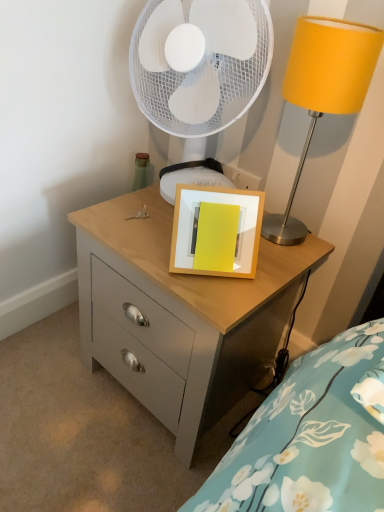
I want to click on white mesh mechanical fan at upper center, so click(x=206, y=72).

Describe the element at coordinates (202, 227) in the screenshot. I see `wooden picture frame at center` at that location.

Image resolution: width=384 pixels, height=512 pixels. I want to click on wooden picture frame at center, so click(202, 227).

Locate an element on the screen. This screenshot has width=384, height=512. white mesh mechanical fan at upper center is located at coordinates (206, 72).

From a real-world perspective, is wooden picture frame at center under white mesh mechanical fan at upper center?

Yes, from a real-world perspective, wooden picture frame at center is beneath white mesh mechanical fan at upper center.

This screenshot has height=512, width=384. I want to click on picture frame below the white mesh mechanical fan at upper center (from a real-world perspective), so click(202, 227).

Looking at this image, considering the sizes of objects wooden picture frame at center and white mesh mechanical fan at upper center in the image provided, who is shorter, wooden picture frame at center or white mesh mechanical fan at upper center?

wooden picture frame at center.

How many degrees apart are the facing directions of wooden picture frame at center and white mesh mechanical fan at upper center?

The angle between the facing direction of wooden picture frame at center and the facing direction of white mesh mechanical fan at upper center is 41.6 degrees.

Which is farther, (187,246) or (177,378)?

The point (177,378) is more distant.

Between wooden picture frame at center and matte wood chest of drawers at center, which one appears on the right side from the viewer's perspective?

Positioned to the right is wooden picture frame at center.

Can you confirm if wooden picture frame at center is thinner than matte wood chest of drawers at center?

Yes, wooden picture frame at center is thinner than matte wood chest of drawers at center.

Looking at the image, does wooden picture frame at center seem bigger or smaller compared to matte wood chest of drawers at center?

Clearly, wooden picture frame at center is smaller in size than matte wood chest of drawers at center.

Which is closer, (x=380, y=32) or (x=216, y=200)?

Clearly, point (x=380, y=32) is closer to the camera than point (x=216, y=200).

Looking at the image, does metallic yellow lampshade at upper right seem bigger or smaller compared to wooden picture frame at center?

Clearly, metallic yellow lampshade at upper right is larger in size than wooden picture frame at center.

How far apart are metallic yellow lampshade at upper right and wooden picture frame at center?

The distance of metallic yellow lampshade at upper right from wooden picture frame at center is 8.93 inches.

How different are the orientations of metallic yellow lampshade at upper right and wooden picture frame at center in degrees?

43.2 degrees separate the facing orientations of metallic yellow lampshade at upper right and wooden picture frame at center.

Is point (162, 195) farther from viewer compared to point (247, 317)?

Yes, it is behind point (247, 317).

Which is in front, white mesh mechanical fan at upper center or matte wood chest of drawers at center?

matte wood chest of drawers at center is in front.

Considering the sizes of objects white mesh mechanical fan at upper center and matte wood chest of drawers at center in the image provided, who is taller, white mesh mechanical fan at upper center or matte wood chest of drawers at center?

Standing taller between the two is matte wood chest of drawers at center.

Is there a large distance between white mesh mechanical fan at upper center and matte wood chest of drawers at center?

That's not correct — white mesh mechanical fan at upper center is a little close to matte wood chest of drawers at center.

Between white mesh mechanical fan at upper center and metallic yellow lampshade at upper right, which one has more height?

white mesh mechanical fan at upper center.

Does white mesh mechanical fan at upper center have a larger size compared to metallic yellow lampshade at upper right?

Indeed, white mesh mechanical fan at upper center has a larger size compared to metallic yellow lampshade at upper right.

From a real-world perspective, is white mesh mechanical fan at upper center physically located above or below metallic yellow lampshade at upper right?

white mesh mechanical fan at upper center is above metallic yellow lampshade at upper right.

From the image's perspective, which object appears higher, white mesh mechanical fan at upper center or metallic yellow lampshade at upper right?

white mesh mechanical fan at upper center, from the image's perspective.

Where is `table lamp located above the wooden picture frame at center (from a real-world perspective)`? The width and height of the screenshot is (384, 512). table lamp located above the wooden picture frame at center (from a real-world perspective) is located at coordinates (323, 91).

Considering the relative sizes of wooden picture frame at center and metallic yellow lampshade at upper right in the image provided, is wooden picture frame at center bigger than metallic yellow lampshade at upper right?

No.

Is point (178, 220) behind point (316, 37)?

Yes, it is behind point (316, 37).

The image size is (384, 512). I want to click on the chest of drawers that is under the white mesh mechanical fan at upper center (from a real-world perspective), so click(184, 314).

Is matte wood chest of drawers at center to the left of white mesh mechanical fan at upper center from the viewer's perspective?

In fact, matte wood chest of drawers at center is to the right of white mesh mechanical fan at upper center.

Considering the relative positions of matte wood chest of drawers at center and white mesh mechanical fan at upper center in the image provided, is matte wood chest of drawers at center in front of white mesh mechanical fan at upper center?

Yes, the depth of matte wood chest of drawers at center is less than that of white mesh mechanical fan at upper center.

Which of these two, matte wood chest of drawers at center or white mesh mechanical fan at upper center, is smaller?

white mesh mechanical fan at upper center is smaller.

Image resolution: width=384 pixels, height=512 pixels. What are the coordinates of `picture frame that is below the white mesh mechanical fan at upper center (from the image's perspective)` in the screenshot? It's located at (202, 227).

Locate an element on the screen. This screenshot has height=512, width=384. picture frame above the matte wood chest of drawers at center (from the image's perspective) is located at coordinates (202, 227).

When comparing their distances from white mesh mechanical fan at upper center, does matte wood chest of drawers at center or metallic yellow lampshade at upper right seem closer?

Among the two, metallic yellow lampshade at upper right is located nearer to white mesh mechanical fan at upper center.

Estimate the real-world distances between objects in this image. Which object is closer to matte wood chest of drawers at center, white mesh mechanical fan at upper center or wooden picture frame at center?

wooden picture frame at center lies closer to matte wood chest of drawers at center than the other object.

From the image, which object appears to be nearer to white mesh mechanical fan at upper center, metallic yellow lampshade at upper right or wooden picture frame at center?

The object closer to white mesh mechanical fan at upper center is metallic yellow lampshade at upper right.

Looking at the image, which one is located further to wooden picture frame at center, white mesh mechanical fan at upper center or matte wood chest of drawers at center?

white mesh mechanical fan at upper center.

When comparing their distances from matte wood chest of drawers at center, does metallic yellow lampshade at upper right or white mesh mechanical fan at upper center seem closer?

Among the two, metallic yellow lampshade at upper right is located nearer to matte wood chest of drawers at center.

Based on their spatial positions, is wooden picture frame at center or metallic yellow lampshade at upper right further from matte wood chest of drawers at center?

metallic yellow lampshade at upper right lies further to matte wood chest of drawers at center than the other object.

Considering their positions, is matte wood chest of drawers at center positioned closer to wooden picture frame at center than white mesh mechanical fan at upper center?

Among the two, matte wood chest of drawers at center is located nearer to wooden picture frame at center.

Estimate the real-world distances between objects in this image. Which object is further from white mesh mechanical fan at upper center, wooden picture frame at center or metallic yellow lampshade at upper right?

The object further to white mesh mechanical fan at upper center is wooden picture frame at center.

The image size is (384, 512). Identify the location of table lamp between white mesh mechanical fan at upper center and matte wood chest of drawers at center from top to bottom. (323, 91).

Identify the location of picture frame between metallic yellow lampshade at upper right and matte wood chest of drawers at center in the vertical direction. The image size is (384, 512). point(202,227).

Locate an element on the screen. The image size is (384, 512). table lamp between white mesh mechanical fan at upper center and wooden picture frame at center from top to bottom is located at coordinates (323, 91).

I want to click on picture frame between white mesh mechanical fan at upper center and matte wood chest of drawers at center vertically, so click(202, 227).